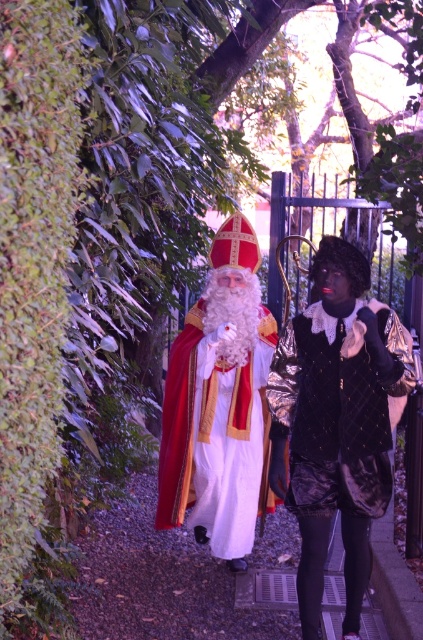
Is point (5, 12) more distant than point (299, 577)?

No, (5, 12) is in front of (299, 577).

Who is more forward, [69,20] or [308,324]?

Point [69,20] is more forward.

The height and width of the screenshot is (640, 423). In order to click on green leafy hedge at left in this screenshot , I will do `click(33, 260)`.

What do you see at coordinates (33, 260) in the screenshot?
I see `green leafy hedge at left` at bounding box center [33, 260].

Between green leafy hedge at left and matte gold and red robe at center, which one is positioned higher?

green leafy hedge at left

Find the location of a particular element. green leafy hedge at left is located at coordinates (33, 260).

Looking at this image, how far apart are green leafy hedge at left and pebble gravel pavement at center?

green leafy hedge at left and pebble gravel pavement at center are 8.78 feet apart.

Where is `green leafy hedge at left`? green leafy hedge at left is located at coordinates coord(33,260).